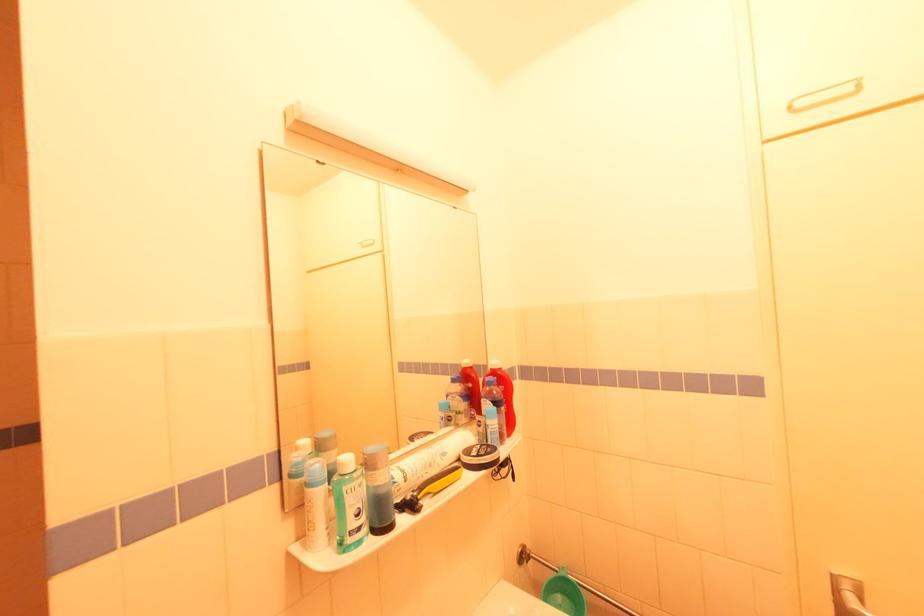
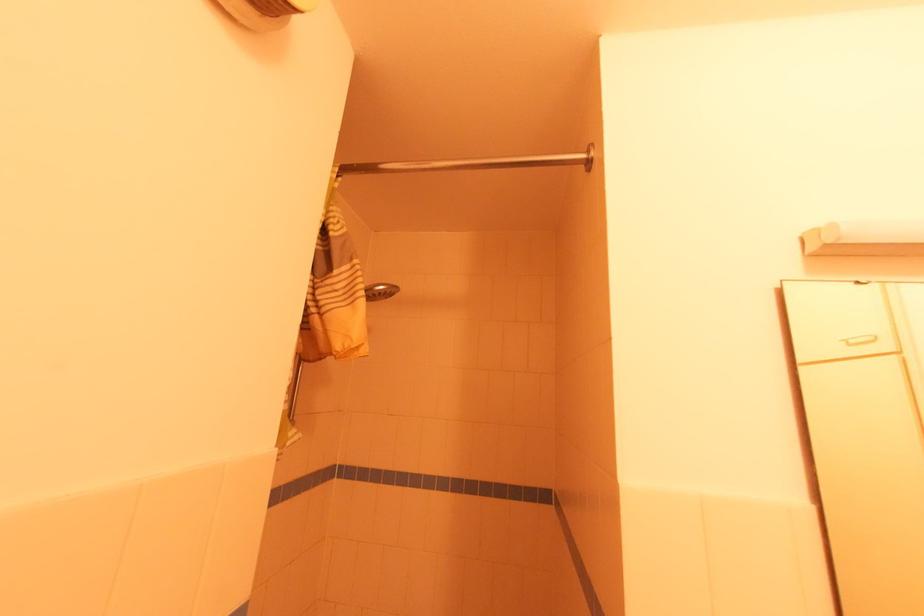
Where in the second image is the point corresponding to the point at 373,243 from the first image?

(871, 339)